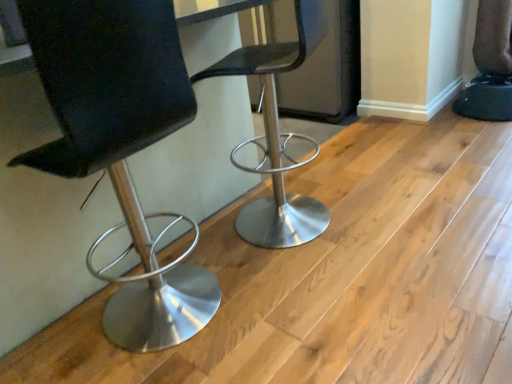
This screenshot has width=512, height=384. What do you see at coordinates (277, 135) in the screenshot?
I see `metallic silver stool at center, the first chair viewed from the right` at bounding box center [277, 135].

Locate an element on the screen. The height and width of the screenshot is (384, 512). metallic silver stool at center, marked as the 2th chair in a left-to-right arrangement is located at coordinates (277, 135).

Describe the element at coordinates (120, 141) in the screenshot. I see `black leather chair at left, which is the 2th chair in right-to-left order` at that location.

Find the location of a particular element. Image resolution: width=512 pixels, height=384 pixels. black leather chair at left, which is counted as the first chair, starting from the left is located at coordinates 120,141.

I want to click on metallic silver stool at center, the first chair viewed from the right, so click(x=277, y=135).

Does metallic silver stool at center, the first chair viewed from the right, appear on the left side of black leather chair at left, which is counted as the first chair, starting from the left?

Incorrect, metallic silver stool at center, the first chair viewed from the right, is not on the left side of black leather chair at left, which is counted as the first chair, starting from the left.

Is metallic silver stool at center, marked as the 2th chair in a left-to-right arrangement, closer to the viewer compared to black leather chair at left, which is the 2th chair in right-to-left order?

No, it is behind black leather chair at left, which is the 2th chair in right-to-left order.

Considering the positions of point (239, 229) and point (120, 59), is point (239, 229) closer or farther from the camera than point (120, 59)?

Point (239, 229) appears to be farther away from the viewer than point (120, 59).

From the image's perspective, which one is positioned lower, metallic silver stool at center, the first chair viewed from the right, or black leather chair at left, which is counted as the first chair, starting from the left?

black leather chair at left, which is counted as the first chair, starting from the left.

From a real-world perspective, who is located higher, metallic silver stool at center, marked as the 2th chair in a left-to-right arrangement, or black leather chair at left, which is the 2th chair in right-to-left order?

black leather chair at left, which is the 2th chair in right-to-left order, is physically above.

Considering the relative sizes of metallic silver stool at center, the first chair viewed from the right, and black leather chair at left, which is counted as the first chair, starting from the left, in the image provided, is metallic silver stool at center, the first chair viewed from the right, wider than black leather chair at left, which is counted as the first chair, starting from the left,?

Indeed, metallic silver stool at center, the first chair viewed from the right, has a greater width compared to black leather chair at left, which is counted as the first chair, starting from the left.

Considering the sizes of objects metallic silver stool at center, the first chair viewed from the right, and black leather chair at left, which is counted as the first chair, starting from the left, in the image provided, who is taller, metallic silver stool at center, the first chair viewed from the right, or black leather chair at left, which is counted as the first chair, starting from the left,?

Standing taller between the two is black leather chair at left, which is counted as the first chair, starting from the left.

In the scene shown: Can you confirm if metallic silver stool at center, marked as the 2th chair in a left-to-right arrangement, is bigger than black leather chair at left, which is counted as the first chair, starting from the left?

No, metallic silver stool at center, marked as the 2th chair in a left-to-right arrangement, is not bigger than black leather chair at left, which is counted as the first chair, starting from the left.

Would you say black leather chair at left, which is counted as the first chair, starting from the left, is part of metallic silver stool at center, the first chair viewed from the right,'s contents?

Actually, black leather chair at left, which is counted as the first chair, starting from the left, is outside metallic silver stool at center, the first chair viewed from the right.

Are metallic silver stool at center, marked as the 2th chair in a left-to-right arrangement, and black leather chair at left, which is counted as the first chair, starting from the left, located far from each other?

metallic silver stool at center, marked as the 2th chair in a left-to-right arrangement, is actually quite close to black leather chair at left, which is counted as the first chair, starting from the left.

Is black leather chair at left, which is the 2th chair in right-to-left order, at the back of metallic silver stool at center, marked as the 2th chair in a left-to-right arrangement?

No, metallic silver stool at center, marked as the 2th chair in a left-to-right arrangement, is not facing away from black leather chair at left, which is the 2th chair in right-to-left order.

At what (x,y) coordinates should I click in order to perform the action: click on chair in front of the metallic silver stool at center, the first chair viewed from the right. Please return your answer as a coordinate pair (x, y). Image resolution: width=512 pixels, height=384 pixels. Looking at the image, I should click on (120, 141).

Is black leather chair at left, which is counted as the first chair, starting from the left, at the right side of metallic silver stool at center, marked as the 2th chair in a left-to-right arrangement?

In fact, black leather chair at left, which is counted as the first chair, starting from the left, is to the left of metallic silver stool at center, marked as the 2th chair in a left-to-right arrangement.

Relative to metallic silver stool at center, the first chair viewed from the right, is black leather chair at left, which is counted as the first chair, starting from the left, in front or behind?

Visually, black leather chair at left, which is counted as the first chair, starting from the left, is located in front of metallic silver stool at center, the first chair viewed from the right.

Does point (130, 113) come farther from viewer compared to point (273, 56)?

That is False.

From the image's perspective, is black leather chair at left, which is counted as the first chair, starting from the left, above or below metallic silver stool at center, marked as the 2th chair in a left-to-right arrangement?

From the image's perspective, black leather chair at left, which is counted as the first chair, starting from the left, appears below metallic silver stool at center, marked as the 2th chair in a left-to-right arrangement.

From a real-world perspective, which is physically below, black leather chair at left, which is the 2th chair in right-to-left order, or metallic silver stool at center, marked as the 2th chair in a left-to-right arrangement?

In real-world perspective, metallic silver stool at center, marked as the 2th chair in a left-to-right arrangement, is lower.

Considering the relative sizes of black leather chair at left, which is counted as the first chair, starting from the left, and metallic silver stool at center, marked as the 2th chair in a left-to-right arrangement, in the image provided, is black leather chair at left, which is counted as the first chair, starting from the left, thinner than metallic silver stool at center, marked as the 2th chair in a left-to-right arrangement,?

Indeed, black leather chair at left, which is counted as the first chair, starting from the left, has a lesser width compared to metallic silver stool at center, marked as the 2th chair in a left-to-right arrangement.

Can you confirm if black leather chair at left, which is counted as the first chair, starting from the left, is taller than metallic silver stool at center, marked as the 2th chair in a left-to-right arrangement?

Correct, black leather chair at left, which is counted as the first chair, starting from the left, is much taller as metallic silver stool at center, marked as the 2th chair in a left-to-right arrangement.

Based on their sizes in the image, would you say black leather chair at left, which is the 2th chair in right-to-left order, is bigger or smaller than metallic silver stool at center, marked as the 2th chair in a left-to-right arrangement?

Clearly, black leather chair at left, which is the 2th chair in right-to-left order, is larger in size than metallic silver stool at center, marked as the 2th chair in a left-to-right arrangement.

Is metallic silver stool at center, the first chair viewed from the right, inside black leather chair at left, which is the 2th chair in right-to-left order?

No, metallic silver stool at center, the first chair viewed from the right, is not inside black leather chair at left, which is the 2th chair in right-to-left order.

Is black leather chair at left, which is the 2th chair in right-to-left order, far away from metallic silver stool at center, marked as the 2th chair in a left-to-right arrangement?

black leather chair at left, which is the 2th chair in right-to-left order, is near metallic silver stool at center, marked as the 2th chair in a left-to-right arrangement, not far away.

Could you tell me if black leather chair at left, which is the 2th chair in right-to-left order, is turned towards metallic silver stool at center, marked as the 2th chair in a left-to-right arrangement?

No, black leather chair at left, which is the 2th chair in right-to-left order, is not turned towards metallic silver stool at center, marked as the 2th chair in a left-to-right arrangement.

How many degrees apart are the facing directions of black leather chair at left, which is counted as the first chair, starting from the left, and metallic silver stool at center, marked as the 2th chair in a left-to-right arrangement?

They differ by 8.37e-05 degrees in their facing directions.

How far apart are black leather chair at left, which is the 2th chair in right-to-left order, and metallic silver stool at center, marked as the 2th chair in a left-to-right arrangement?

black leather chair at left, which is the 2th chair in right-to-left order, and metallic silver stool at center, marked as the 2th chair in a left-to-right arrangement, are 55.54 centimeters apart.

What are the coordinates of `chair on the right of black leather chair at left, which is the 2th chair in right-to-left order` in the screenshot? It's located at (277, 135).

This screenshot has height=384, width=512. I want to click on chair below the black leather chair at left, which is the 2th chair in right-to-left order (from a real-world perspective), so click(277, 135).

Where is `chair above the black leather chair at left, which is the 2th chair in right-to-left order (from the image's perspective)`? The width and height of the screenshot is (512, 384). chair above the black leather chair at left, which is the 2th chair in right-to-left order (from the image's perspective) is located at coordinates (277, 135).